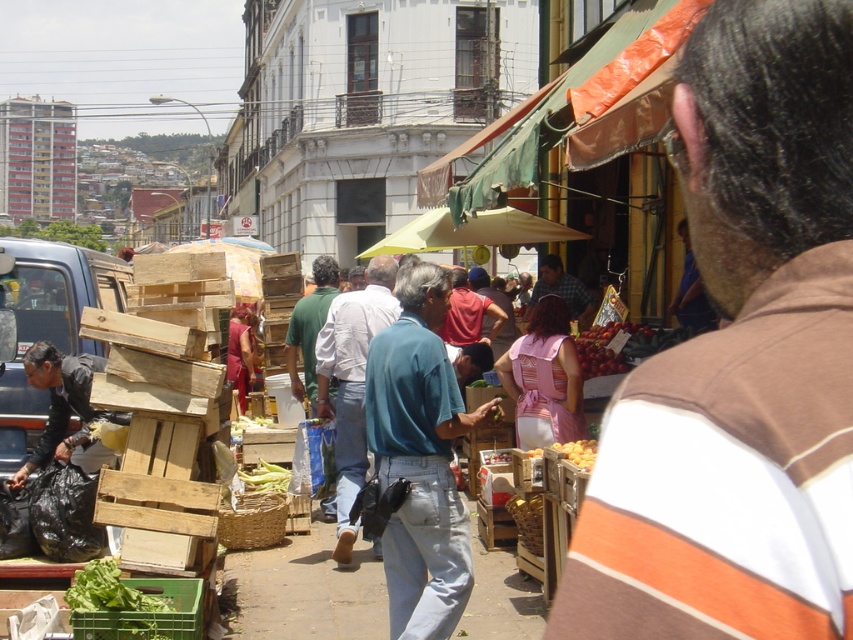
You are standing at the point with coordinates point (x=45, y=387) and want to walk to the point with coordinates point (x=590, y=467). Is there any obstruction between you and your destination?

Point (x=45, y=387) is behind point (x=590, y=467), so there is an obstruction between them.

You are a customer at the market and want to buy both the shiny red apples at center and the green matte corn at center. If you have a small basket that can only hold one type of produce, which one should you choose based on their size?

The shiny red apples at center are larger in size than the green matte corn at center, so you should choose the shiny red apples at center to fit in your small basket.

Where is the teal cotton shirt at center located in the image?

The teal cotton shirt at center is located at point 0.717 on the x axis and 0.494 on the y axis.